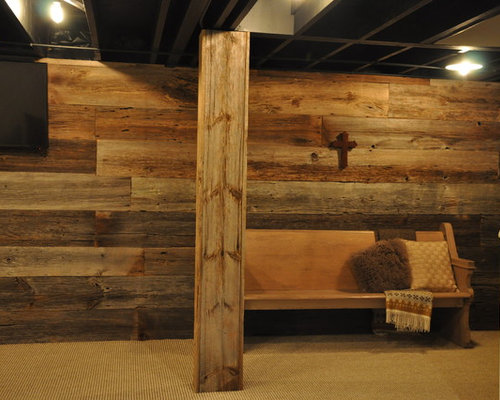
You are a GUI agent. You are given a task and a screenshot of the screen. Output one action in this format:
    pyautogui.click(x=<x>, y=<y>)
    Task: Click on the bench
    Image resolution: width=500 pixels, height=400 pixels.
    Given the screenshot: What is the action you would take?
    pyautogui.click(x=321, y=265)